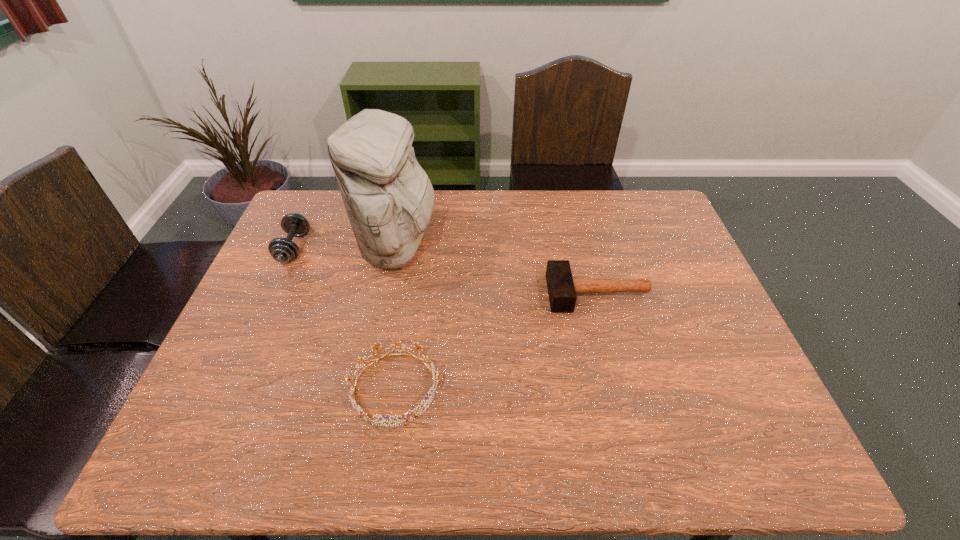
Where is `free space between the dumbbell and the rightmost object`? Image resolution: width=960 pixels, height=540 pixels. free space between the dumbbell and the rightmost object is located at coordinates (446, 271).

At what (x,y) coordinates should I click in order to perform the action: click on vacant area that lies between the nearest object and the tallest object. Please return your answer as a coordinate pair (x, y). This screenshot has height=540, width=960. Looking at the image, I should click on (396, 318).

Where is `empty space between the nearest object and the rightmost object`? This screenshot has height=540, width=960. empty space between the nearest object and the rightmost object is located at coordinates (496, 341).

I want to click on the closest object relative to the mallet, so 362,414.

Find the location of a particular element. object that is the third nearest to the tiara is located at coordinates (283, 250).